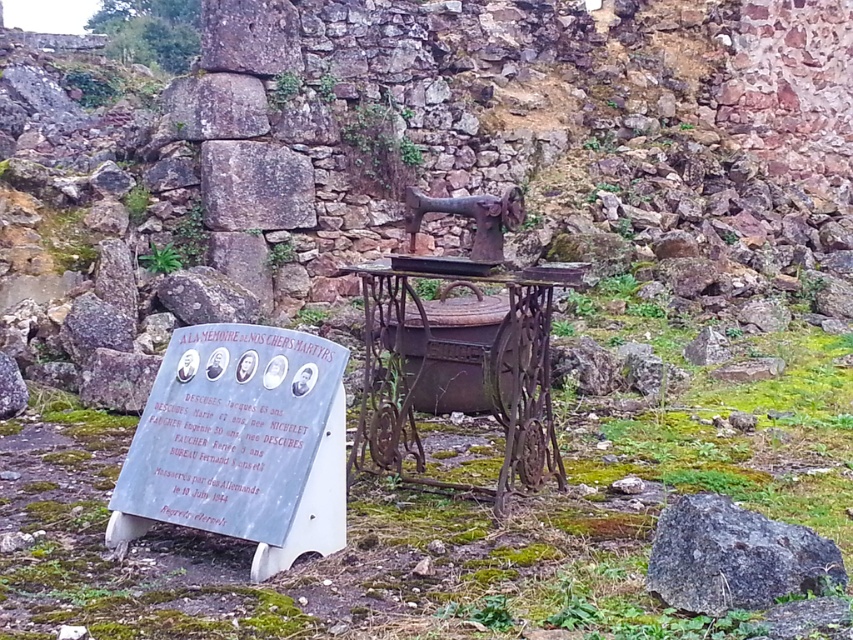
Looking at this image, you are a tour guide leading a group to the gray stone plaque at center and the rusty metal sewing machine at center. The group asks if they can touch both items without damaging them. Based on their spacing, can they comfortably reach both without moving closer than 18 inches apart?

The gray stone plaque at center and the rusty metal sewing machine at center are 18.70 inches apart. Since the minimum distance required is 18 inches, they can comfortably reach both items without needing to move closer than that distance.

What is located at the point with coordinates [241,444] in the image?

The point at coordinates [241,444] marks the location of the gray stone plaque at center.